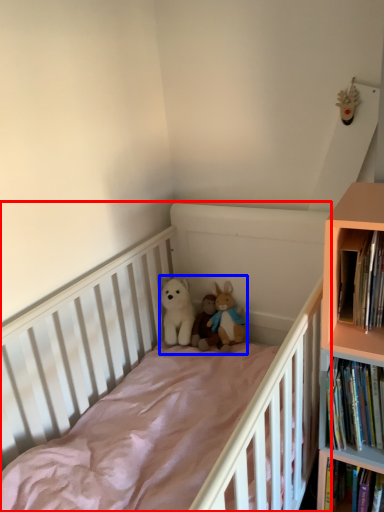
Question: Which point is closer to the camera, infant bed (highlighted by a red box) or toy (highlighted by a blue box)?

Choices:
 (A) infant bed
 (B) toy

Answer: (A)